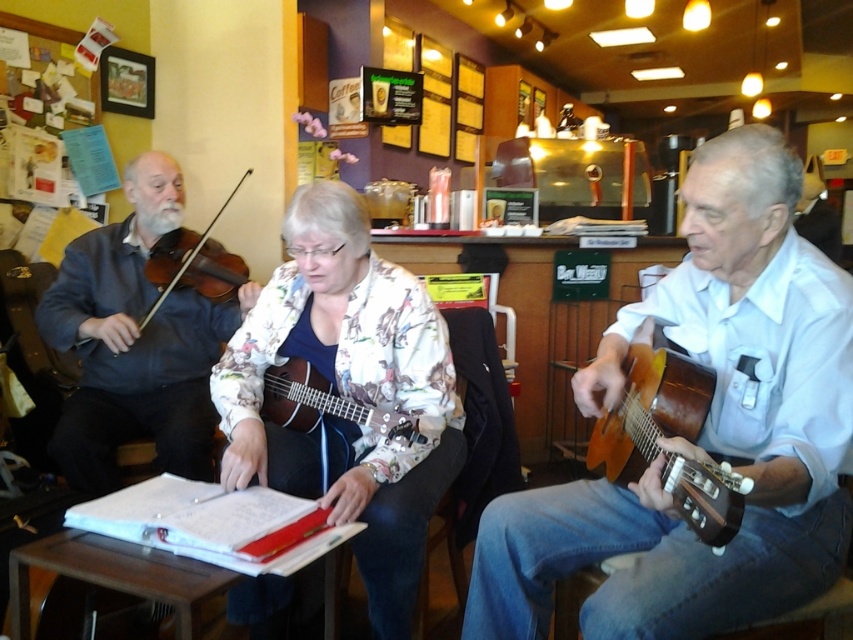
You are a musician who wants to carry both the shiny brown acoustic guitar at right and the matte brown ukulele at center in a case that can only hold instruments up to the width of the wider one. Which instrument determines the minimum required case width?

The matte brown ukulele at center is wider than the shiny brown acoustic guitar at right, so the case must be at least as wide as the matte brown ukulele at center to accommodate both instruments.

You are a customer sitting at a table in the middle of the room. You want to order a drink from the counter located behind the violinist. Can you reach the counter without passing between the wooden acoustic guitar at center right and the matte brown violin at left?

The wooden acoustic guitar at center right is 5.24 feet away from the matte brown violin at left, so the distance between them is sufficient to allow you to walk around either side without needing to pass directly between them to reach the counter.